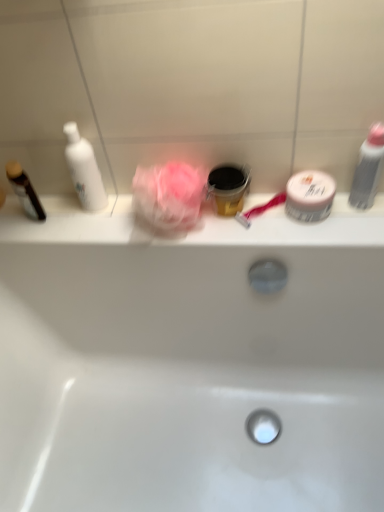
The image size is (384, 512). I want to click on free location in front of dark brown glossy bottle at left, which is the 1th toiletry from left to right, so click(39, 234).